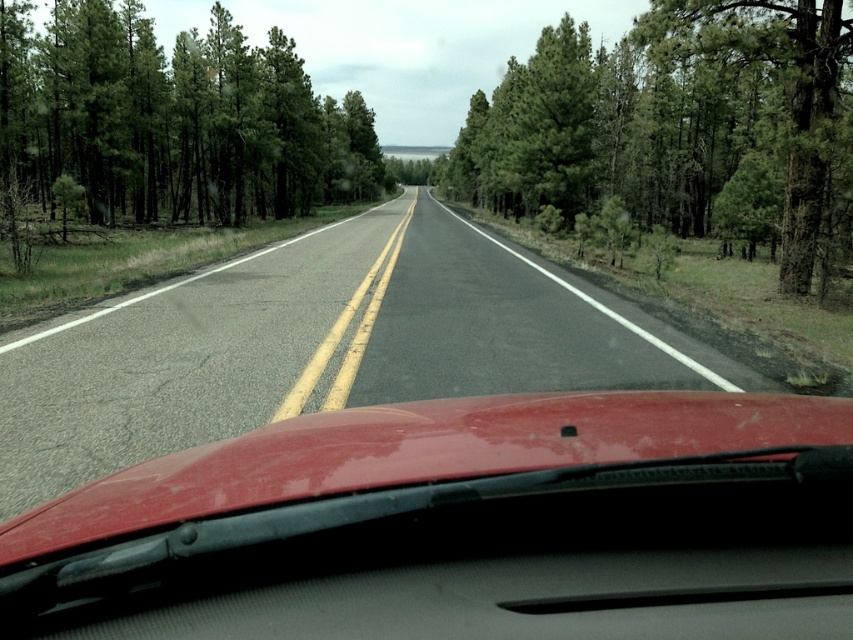
You are driving a car with a trunk length of 1.5 meters. You see a green textured tree at center and a green matte tree at left from your driver seat. If you want to park your car between them, will your trunk fit entirely within the space between the trees?

The green textured tree at center and green matte tree at left are 16.75 meters apart from each other. Since your trunk is only 1.5 meters long, it will easily fit within the space between the trees.

You are a passenger in the vehicle and notice a point marked at coordinates (321, 346). Based on the scene description, what is located at that point?

The point at coordinates (321, 346) is where the asphalt road at center is located.